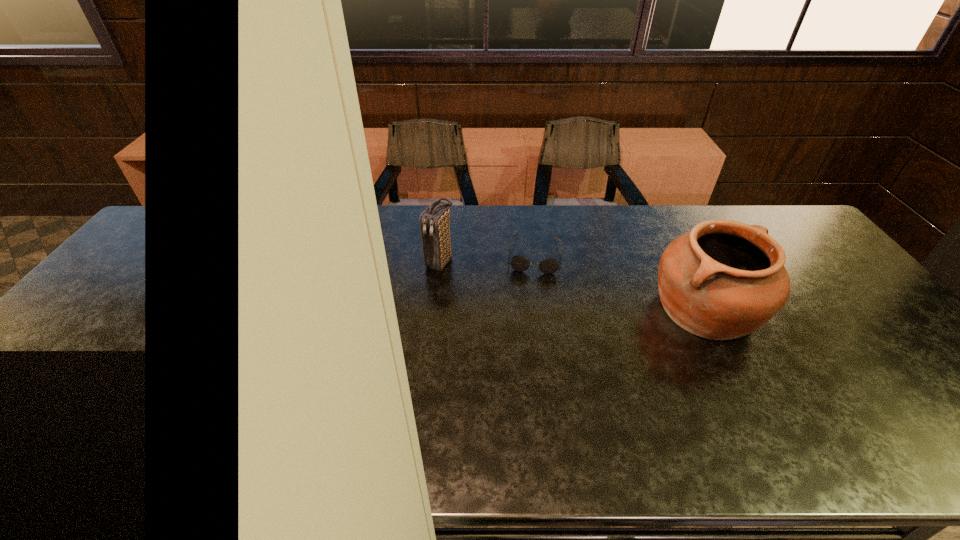
At what (x,y) coordinates should I click in order to perform the action: click on blank space located 0.320m with the zip open on the leftmost object. Please return your answer as a coordinate pair (x, y). This screenshot has height=540, width=960. Looking at the image, I should click on (367, 349).

Find the location of `object located at the far edge`. object located at the far edge is located at coordinates coord(519,263).

This screenshot has height=540, width=960. What are the coordinates of `vacant region at the far edge` in the screenshot? It's located at (557, 215).

You are a GUI agent. You are given a task and a screenshot of the screen. Output one action in this format:
    pyautogui.click(x=<x>, y=<y>)
    Task: Click on the vacant space at the near edge of the desktop
    The width and height of the screenshot is (960, 540).
    Given the screenshot: What is the action you would take?
    529,395

You are a GUI agent. You are given a task and a screenshot of the screen. Output one action in this format:
    pyautogui.click(x=<x>, y=<y>)
    Task: Click on the vacant region at the right edge of the desktop
    Image resolution: width=960 pixels, height=540 pixels.
    Given the screenshot: What is the action you would take?
    pos(841,271)

I want to click on vacant space at the far left corner, so [x=212, y=221].

You are a GUI agent. You are given a task and a screenshot of the screen. Output one action in this format:
    pyautogui.click(x=<x>, y=<y>)
    Task: Click on the free space at the far right corner of the desktop
    
    Given the screenshot: What is the action you would take?
    pyautogui.click(x=750, y=217)

You are a GUI agent. You are given a task and a screenshot of the screen. Output one action in this format:
    pyautogui.click(x=<x>, y=<y>)
    Task: Click on the empty space between the second object from right to left and the clutch bag
    Image resolution: width=960 pixels, height=540 pixels.
    Given the screenshot: What is the action you would take?
    pyautogui.click(x=487, y=258)

The height and width of the screenshot is (540, 960). In order to click on free space between the leftmost object and the shortest object in this screenshot , I will do `click(487, 258)`.

I want to click on vacant area that lies between the clutch bag and the second object from right to left, so click(487, 258).